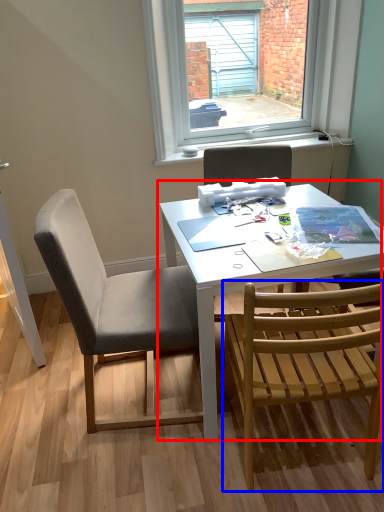
Question: Which object is further to the camera taking this photo, table (highlighted by a red box) or chair (highlighted by a blue box)?

Choices:
 (A) table
 (B) chair

Answer: (A)